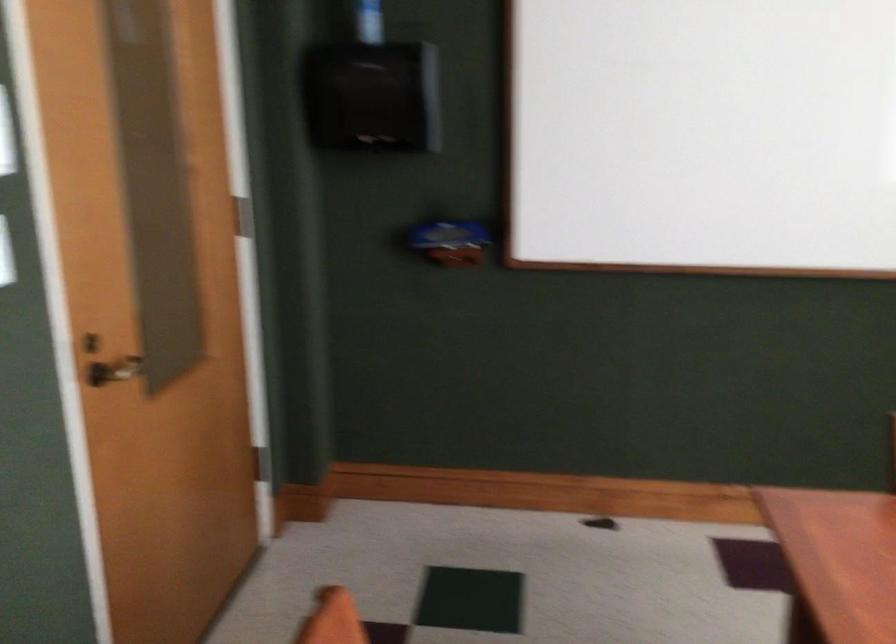
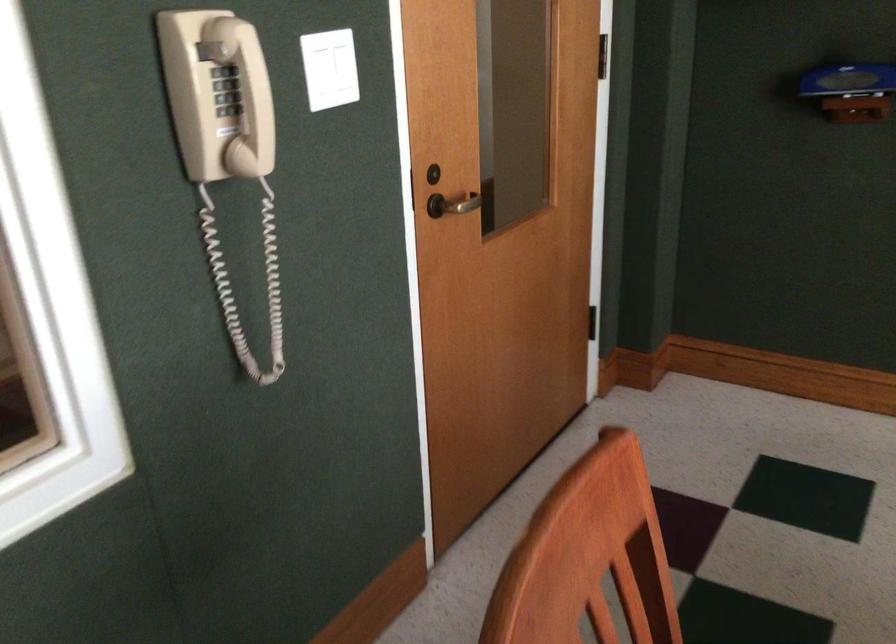
Find the pixel in the second image that matches [74,377] in the first image.

(409, 191)